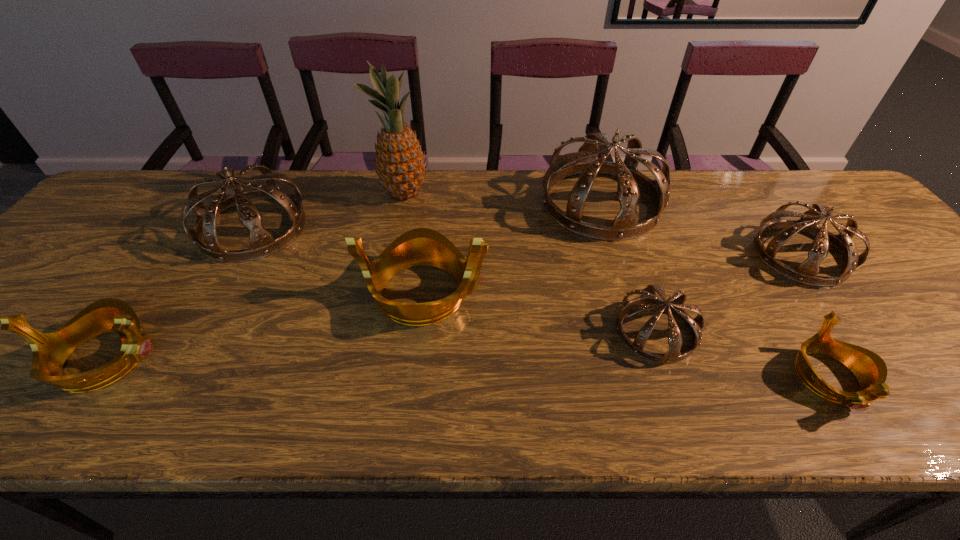
Find the location of a particular element. The width and height of the screenshot is (960, 540). free space that is in between the tallest tiara and the third smallest brown tiara is located at coordinates (427, 215).

This screenshot has height=540, width=960. Find the location of `free space that is in between the biggest brown tiara and the second gold tiara from left to right`. free space that is in between the biggest brown tiara and the second gold tiara from left to right is located at coordinates (513, 248).

Locate an element on the screen. This screenshot has width=960, height=540. free point between the biggest brown tiara and the leftmost gold tiara is located at coordinates (353, 281).

You are a GUI agent. You are given a task and a screenshot of the screen. Output one action in this format:
    pyautogui.click(x=<x>, y=<y>)
    Task: Click on the seventh closest object to the leftmost brown tiara
    The image size is (960, 540).
    Given the screenshot: What is the action you would take?
    pyautogui.click(x=805, y=273)

Identify which object is located as the nearest to the rightmost gold tiara. Please provide its 2D coordinates. Your answer should be formatted as a tuple, i.e. [(x, y)], where the tuple contains the x and y coordinates of a point satisfying the conditions above.

[(805, 273)]

Where is `tiara that is the fourth closest to the biggest gold tiara`? This screenshot has width=960, height=540. tiara that is the fourth closest to the biggest gold tiara is located at coordinates (50, 350).

Identify the location of tiara that can be found as the second closest to the seventh shortest object. (805, 273).

You are a GUI agent. You are given a task and a screenshot of the screen. Output one action in this format:
    pyautogui.click(x=<x>, y=<y>)
    Task: Click on the third closest brown tiara to the second smallest gold tiara
    
    Given the screenshot: What is the action you would take?
    pyautogui.click(x=648, y=300)

Identify which brown tiara is the second nearest to the second gold tiara from right to left. Please provide its 2D coordinates. Your answer should be formatted as a tuple, i.e. [(x, y)], where the tuple contains the x and y coordinates of a point satisfying the conditions above.

[(262, 243)]

Choose which gold tiara is the second nearest neighbor to the second tallest object. Please provide its 2D coordinates. Your answer should be formatted as a tuple, i.e. [(x, y)], where the tuple contains the x and y coordinates of a point satisfying the conditions above.

[(869, 368)]